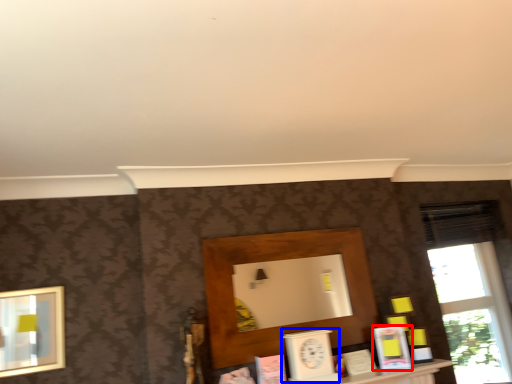
Question: Which object appears closest to the camera in this image, book (highlighted by a red box) or clock (highlighted by a blue box)?

Choices:
 (A) book
 (B) clock

Answer: (B)